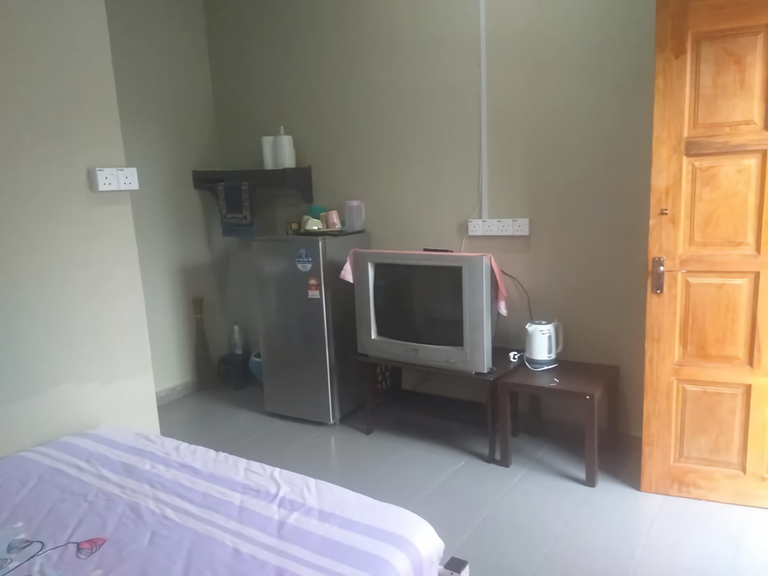
I want to click on purple and white bedspread, so click(x=306, y=537).